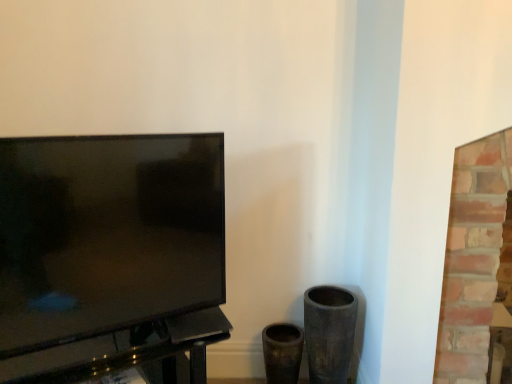
Question: Is matte black tv at left in contact with black glossy table at left?

Choices:
 (A) yes
 (B) no

Answer: (B)

Question: From a real-world perspective, is matte black tv at left over black glossy table at left?

Choices:
 (A) yes
 (B) no

Answer: (A)

Question: Is matte black tv at left at the right side of black glossy table at left?

Choices:
 (A) no
 (B) yes

Answer: (B)

Question: Is matte black tv at left in front of black glossy table at left?

Choices:
 (A) no
 (B) yes

Answer: (B)

Question: Is matte black tv at left shorter than black glossy table at left?

Choices:
 (A) no
 (B) yes

Answer: (A)

Question: Considering the relative positions of matte black tv at left and black glossy table at left in the image provided, is matte black tv at left to the left of black glossy table at left from the viewer's perspective?

Choices:
 (A) yes
 (B) no

Answer: (B)

Question: From the image's perspective, does brick fireplace at right appear lower than black glossy table at left?

Choices:
 (A) no
 (B) yes

Answer: (A)

Question: Could black glossy table at left be considered to be inside brick fireplace at right?

Choices:
 (A) no
 (B) yes

Answer: (A)

Question: From the image's perspective, is brick fireplace at right on top of black glossy table at left?

Choices:
 (A) yes
 (B) no

Answer: (A)

Question: Considering the relative sizes of brick fireplace at right and black glossy table at left in the image provided, is brick fireplace at right thinner than black glossy table at left?

Choices:
 (A) yes
 (B) no

Answer: (A)

Question: Is there a large distance between brick fireplace at right and black glossy table at left?

Choices:
 (A) no
 (B) yes

Answer: (A)

Question: Considering the relative sizes of brick fireplace at right and black glossy table at left in the image provided, is brick fireplace at right bigger than black glossy table at left?

Choices:
 (A) no
 (B) yes

Answer: (B)

Question: Is matte black tv at left wider than brick fireplace at right?

Choices:
 (A) no
 (B) yes

Answer: (A)